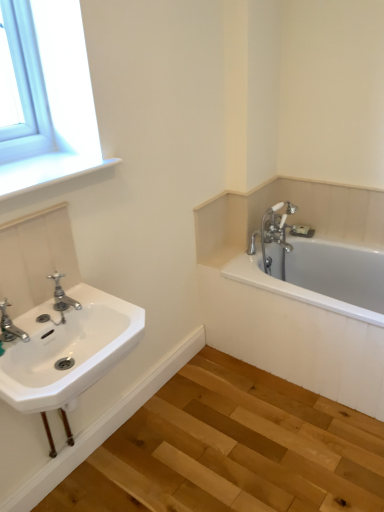
Question: Is white porcelain sink at left not within white ceramic bathtub at right?

Choices:
 (A) yes
 (B) no

Answer: (A)

Question: Is white porcelain sink at left shorter than white ceramic bathtub at right?

Choices:
 (A) no
 (B) yes

Answer: (B)

Question: Considering the relative sizes of white porcelain sink at left and white ceramic bathtub at right in the image provided, is white porcelain sink at left taller than white ceramic bathtub at right?

Choices:
 (A) no
 (B) yes

Answer: (A)

Question: From the image's perspective, is white porcelain sink at left located above white ceramic bathtub at right?

Choices:
 (A) yes
 (B) no

Answer: (B)

Question: From a real-world perspective, does white porcelain sink at left stand above white ceramic bathtub at right?

Choices:
 (A) yes
 (B) no

Answer: (A)

Question: Can you confirm if white porcelain sink at left is positioned to the right of white ceramic bathtub at right?

Choices:
 (A) no
 (B) yes

Answer: (A)

Question: From the image's perspective, does polished chrome faucet at left, arranged as the second tap when viewed from the left, appear lower than brushed metal faucet at lower left, the 1th tap viewed from the front?

Choices:
 (A) yes
 (B) no

Answer: (B)

Question: Is polished chrome faucet at left, arranged as the second tap when viewed from the left, not inside brushed metal faucet at lower left, acting as the 2th tap starting from the back?

Choices:
 (A) yes
 (B) no

Answer: (A)

Question: Is polished chrome faucet at left, arranged as the second tap when viewed from the left, at the right side of brushed metal faucet at lower left, the first tap in the left-to-right sequence?

Choices:
 (A) no
 (B) yes

Answer: (B)

Question: From a real-world perspective, is polished chrome faucet at left, which is the first tap in back-to-front order, on top of brushed metal faucet at lower left, which appears as the 2th tap when viewed from the right?

Choices:
 (A) no
 (B) yes

Answer: (A)

Question: Is brushed metal faucet at lower left, acting as the 2th tap starting from the back, inside polished chrome faucet at left, which is the first tap in back-to-front order?

Choices:
 (A) yes
 (B) no

Answer: (B)

Question: Is polished chrome faucet at left, the 2th tap viewed from the front, further to camera compared to brushed metal faucet at lower left, the first tap in the left-to-right sequence?

Choices:
 (A) yes
 (B) no

Answer: (A)

Question: Considering the relative sizes of white smooth window sill at upper left and polished chrome faucet at left, the 2th tap viewed from the front, in the image provided, is white smooth window sill at upper left wider than polished chrome faucet at left, the 2th tap viewed from the front,?

Choices:
 (A) yes
 (B) no

Answer: (A)